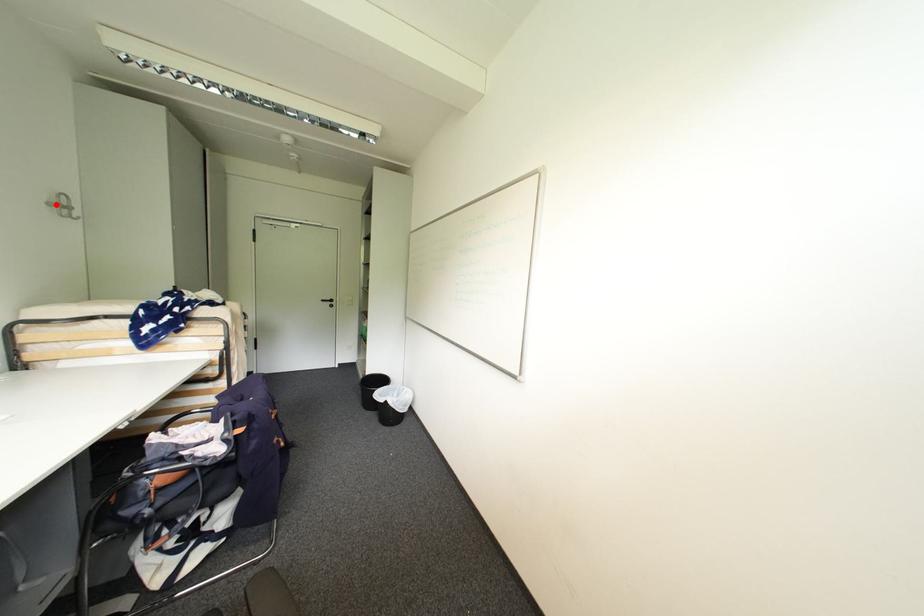
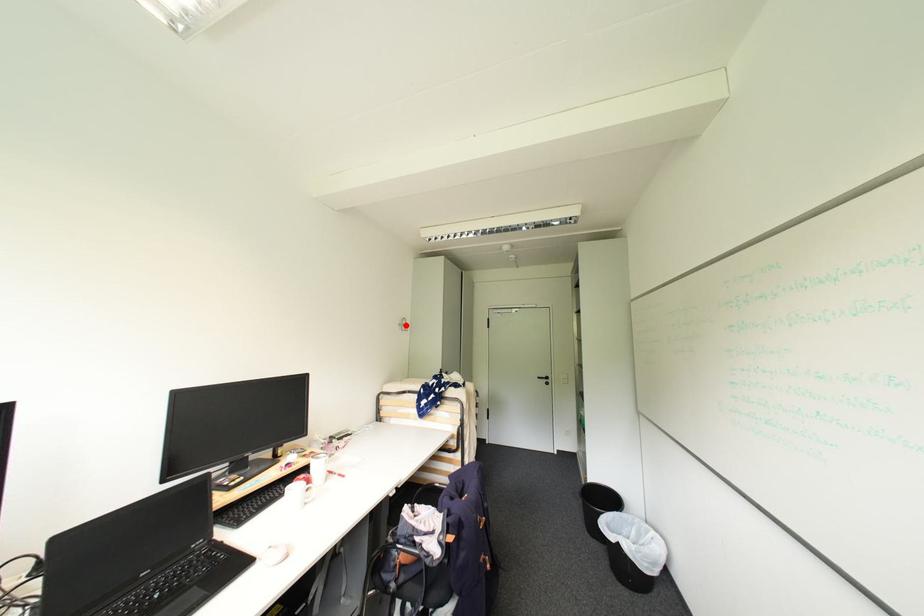
I am providing you with two images of the same scene from different viewpoints. A red point is marked on the first image and another point is marked on the second image. Do the highlighted points in image1 and image2 indicate the same real-world spot?

Yes